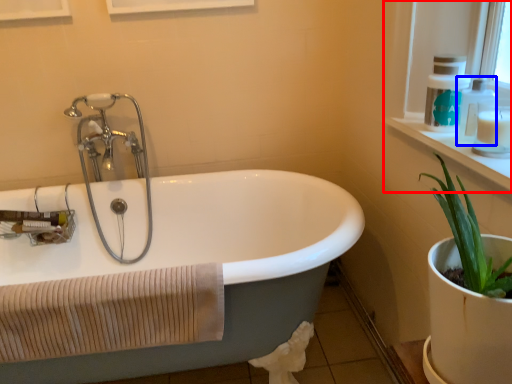
Question: Which of the following is the closest to the observer, window frame (highlighted by a red box) or soap dispenser (highlighted by a blue box)?

Choices:
 (A) window frame
 (B) soap dispenser

Answer: (A)